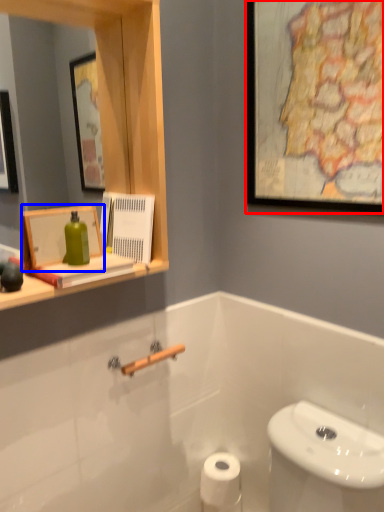
Question: Which object is closer to the camera taking this photo, picture frame (highlighted by a red box) or picture frame (highlighted by a blue box)?

Choices:
 (A) picture frame
 (B) picture frame

Answer: (A)